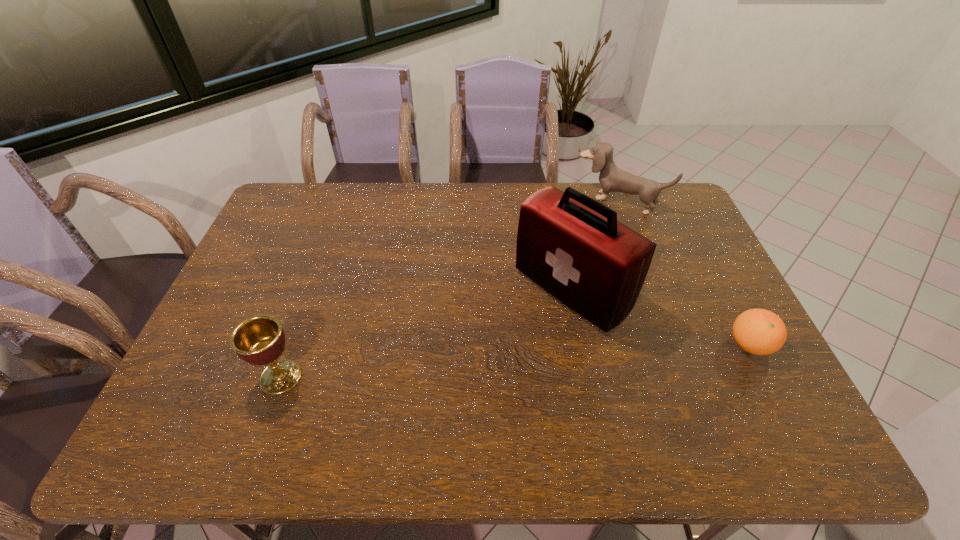
This screenshot has height=540, width=960. Find the location of `free spot at the far left corner of the desktop`. free spot at the far left corner of the desktop is located at coordinates click(x=300, y=205).

Image resolution: width=960 pixels, height=540 pixels. Identify the location of free space between the orange and the puppy. (684, 273).

At what (x,y) coordinates should I click in order to perform the action: click on free space between the first aid kit and the leftmost object. Please return your answer as a coordinate pair (x, y). Looking at the image, I should click on (426, 334).

Where is `free spot between the farthest object and the orange`? free spot between the farthest object and the orange is located at coordinates (684, 273).

The height and width of the screenshot is (540, 960). I want to click on free space between the puppy and the orange, so click(x=684, y=273).

Where is `free point between the orange and the farthest object`? The height and width of the screenshot is (540, 960). free point between the orange and the farthest object is located at coordinates coord(684,273).

What are the coordinates of `free space between the leftmost object and the orange` in the screenshot? It's located at (516, 361).

Where is `empty location between the shortest object and the first aid kit`? empty location between the shortest object and the first aid kit is located at coordinates (660, 318).

Find the location of `empty location between the shortest object and the chalice`. empty location between the shortest object and the chalice is located at coordinates (516, 361).

Image resolution: width=960 pixels, height=540 pixels. What are the coordinates of `free space between the chalice and the first aid kit` in the screenshot? It's located at (426, 334).